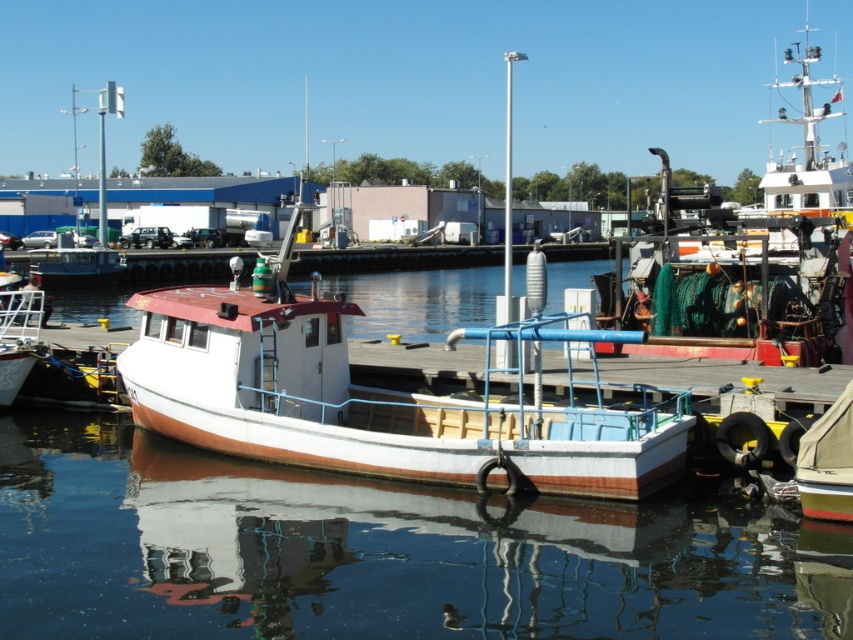
You are a photographer planning to capture the harbor scene. You want to ensure that both the transparent water at center and the yellow rubber dinghy at lower right are clearly visible in your shot. Which object should you focus on first if you want to capture the wider subject?

The transparent water at center should be focused on first because its width surpasses that of the yellow rubber dinghy at lower right, making it the wider subject.

You are a photographer standing on the wooden pier. You want to take a photo that includes both the transparent water at center and the white painted wood boat at center. Which object should you position closer to the front of your camera frame to ensure both are visible?

You should position the transparent water at center closer to the front of your camera frame since it is already in front of the white painted wood boat at center, allowing both to be captured in the photo.